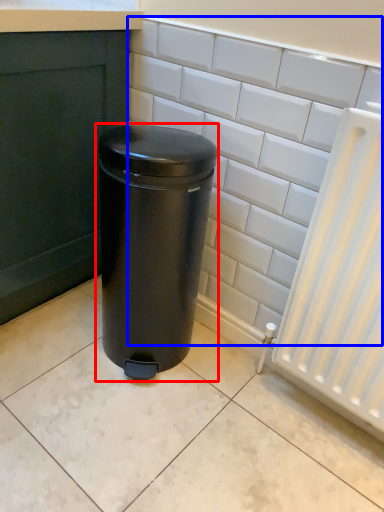
Question: Among these objects, which one is farthest to the camera, waste container (highlighted by a red box) or ceramic tile (highlighted by a blue box)?

Choices:
 (A) waste container
 (B) ceramic tile

Answer: (A)